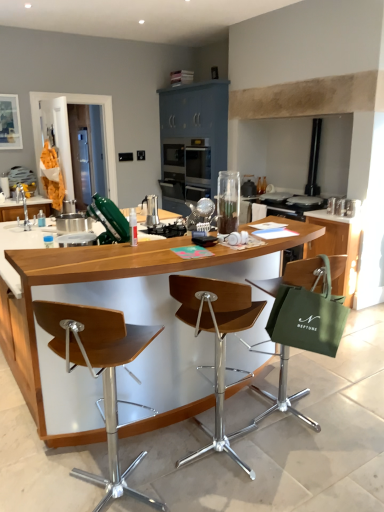
Image resolution: width=384 pixels, height=512 pixels. Find the location of `free spot to the right of green fabric chair at right, the first chair when ordered from right to left`. free spot to the right of green fabric chair at right, the first chair when ordered from right to left is located at coordinates (348, 406).